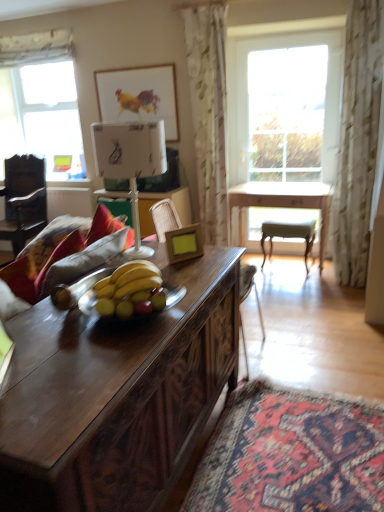
Question: Is clear glass window at upper left, positioned as the second window in front-to-back order, facing towards wooden swivel chair at center?

Choices:
 (A) yes
 (B) no

Answer: (B)

Question: From the image's perspective, is clear glass window at upper left, positioned as the second window in front-to-back order, under wooden swivel chair at center?

Choices:
 (A) no
 (B) yes

Answer: (A)

Question: Considering the relative sizes of clear glass window at upper left, positioned as the second window in front-to-back order, and wooden swivel chair at center in the image provided, is clear glass window at upper left, positioned as the second window in front-to-back order, shorter than wooden swivel chair at center?

Choices:
 (A) no
 (B) yes

Answer: (A)

Question: From a real-world perspective, is clear glass window at upper left, which is the 1th window in back-to-front order, beneath wooden swivel chair at center?

Choices:
 (A) yes
 (B) no

Answer: (B)

Question: Is clear glass window at upper left, which is the 1th window in back-to-front order, to the left of wooden swivel chair at center from the viewer's perspective?

Choices:
 (A) no
 (B) yes

Answer: (B)

Question: From the image's perspective, is clear glass window at upper left, acting as the 2th window starting from the right, located above or below clear glass window at center, which is counted as the 2th window, starting from the back?

Choices:
 (A) below
 (B) above

Answer: (B)

Question: Based on their sizes in the image, would you say clear glass window at upper left, which appears as the 1th window when viewed from the left, is bigger or smaller than clear glass window at center, which is counted as the 2th window, starting from the back?

Choices:
 (A) small
 (B) big

Answer: (A)

Question: Choose the correct answer: Is clear glass window at upper left, which appears as the 1th window when viewed from the left, inside clear glass window at center, the first window from the front, or outside it?

Choices:
 (A) inside
 (B) outside

Answer: (B)

Question: Considering the positions of clear glass window at upper left, which appears as the 1th window when viewed from the left, and clear glass window at center, which is counted as the 2th window, starting from the back, in the image, is clear glass window at upper left, which appears as the 1th window when viewed from the left, wider or thinner than clear glass window at center, which is counted as the 2th window, starting from the back,?

Choices:
 (A) thin
 (B) wide

Answer: (A)

Question: Is dark wood desk at center wider or thinner than light wood table at center?

Choices:
 (A) thin
 (B) wide

Answer: (B)

Question: Relative to light wood table at center, is dark wood desk at center in front or behind?

Choices:
 (A) behind
 (B) front

Answer: (B)

Question: From a real-world perspective, is dark wood desk at center physically located above or below light wood table at center?

Choices:
 (A) below
 (B) above

Answer: (B)

Question: From the image's perspective, is dark wood desk at center above or below light wood table at center?

Choices:
 (A) below
 (B) above

Answer: (A)

Question: Considering the positions of point (119, 97) and point (99, 139), is point (119, 97) closer or farther from the camera than point (99, 139)?

Choices:
 (A) closer
 (B) farther

Answer: (B)

Question: Is watercolor paper picture frame at upper center, the second picture frame viewed from the right, to the left or to the right of white paper lampshade at center in the image?

Choices:
 (A) left
 (B) right

Answer: (A)